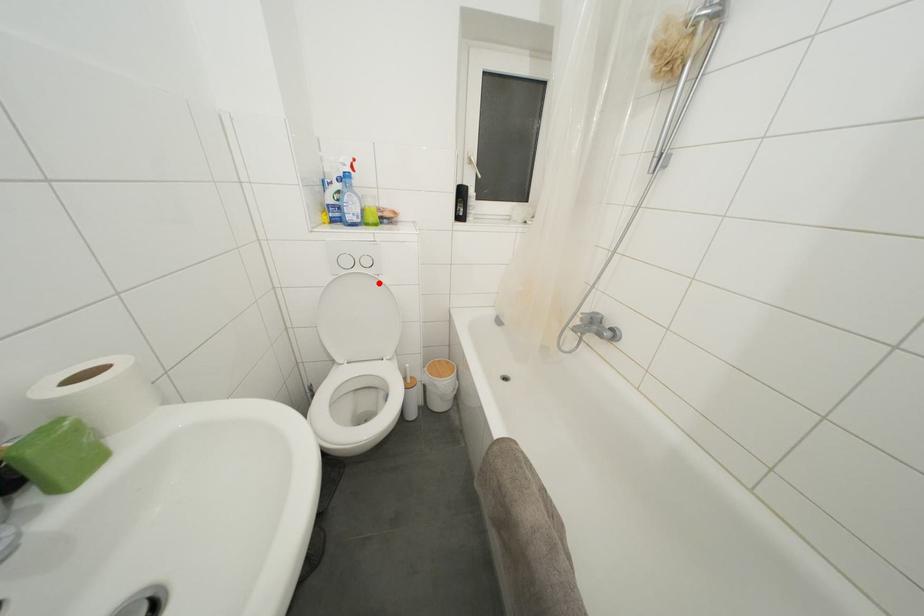
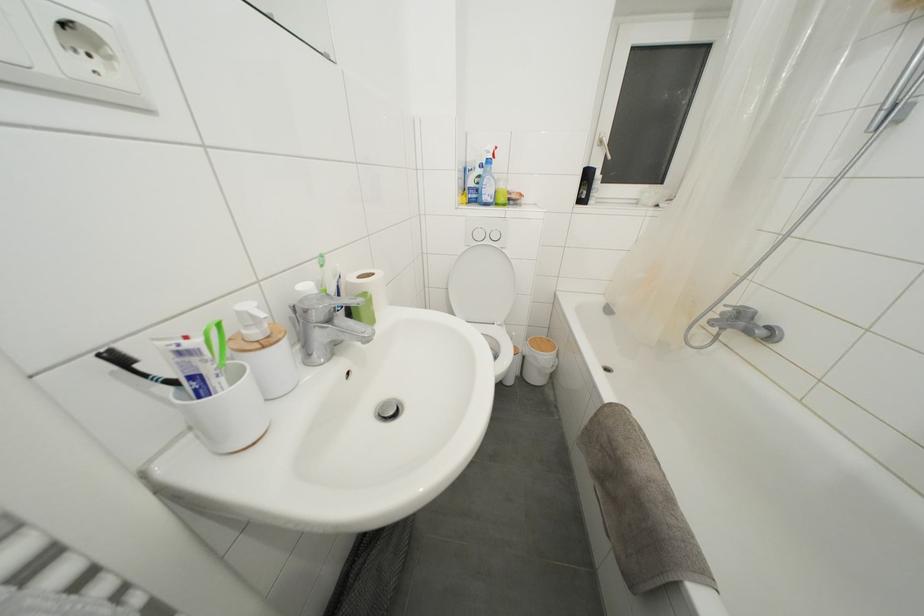
In the second image, find the point that corresponds to the highlighted location in the first image.

(505, 256)